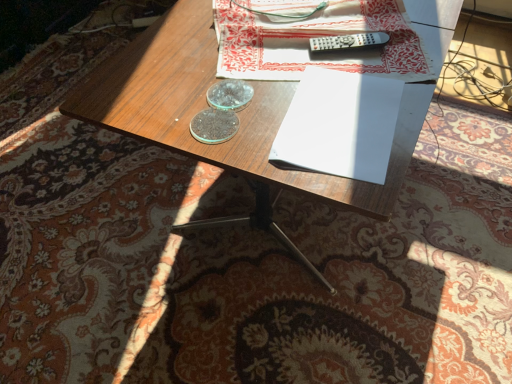
Locate an element on the screen. This screenshot has height=384, width=512. free space to the left of wooden desk at center is located at coordinates click(74, 190).